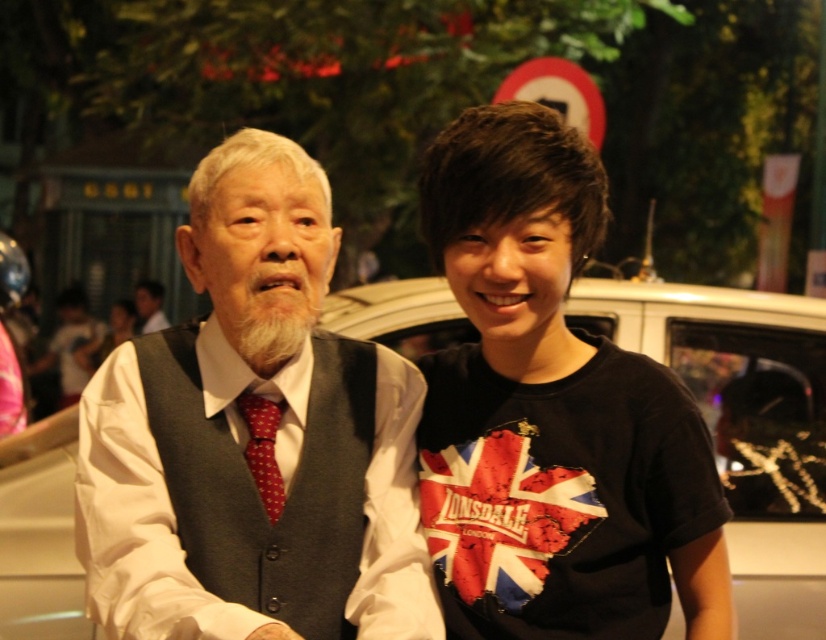
Question: Estimate the real-world distances between objects in this image. Which object is closer to the white shirt at center?

Choices:
 (A) white glossy car at center
 (B) union jack fabric at center

Answer: (A)

Question: In this image, where is polka dot silk tie at center located relative to white shirt at center?

Choices:
 (A) above
 (B) below

Answer: (B)

Question: Is gray wool vest at center bigger than polka dot silk tie at center?

Choices:
 (A) yes
 (B) no

Answer: (A)

Question: Which object is positioned closest to the union jack fabric at center?

Choices:
 (A) white glossy car at center
 (B) black cotton t-shirt at center
 (C) dark gray knitted vest at center

Answer: (B)

Question: Which object is positioned farthest from the polka dot silk tie at center?

Choices:
 (A) gray wool vest at center
 (B) black cotton t-shirt at center
 (C) dark gray knitted vest at center
 (D) union jack fabric at center

Answer: (B)

Question: Does white glossy car at center appear over union jack fabric at center?

Choices:
 (A) no
 (B) yes

Answer: (B)